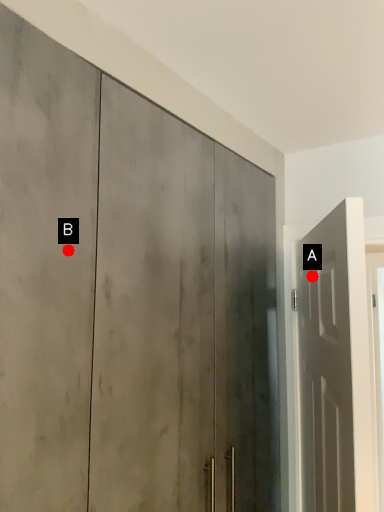
Question: Two points are circled on the image, labeled by A and B beside each circle. Which of the following is the farthest from the observer?

Choices:
 (A) A is further
 (B) B is further

Answer: (A)